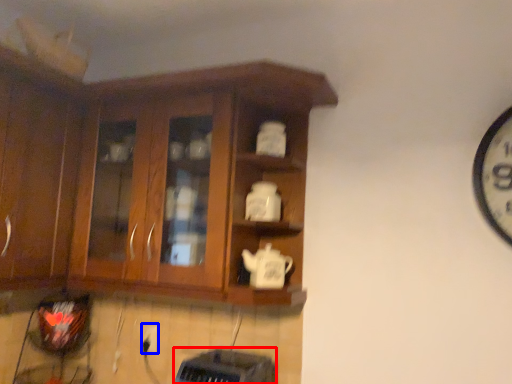
Question: Which object appears closest to the camera in this image, appliance (highlighted by a red box) or electric outlet (highlighted by a blue box)?

Choices:
 (A) appliance
 (B) electric outlet

Answer: (A)